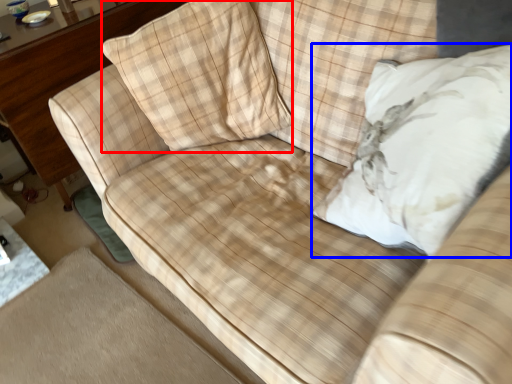
Question: Which of the following is the closest to the observer, throw pillow (highlighted by a red box) or throw pillow (highlighted by a blue box)?

Choices:
 (A) throw pillow
 (B) throw pillow

Answer: (B)